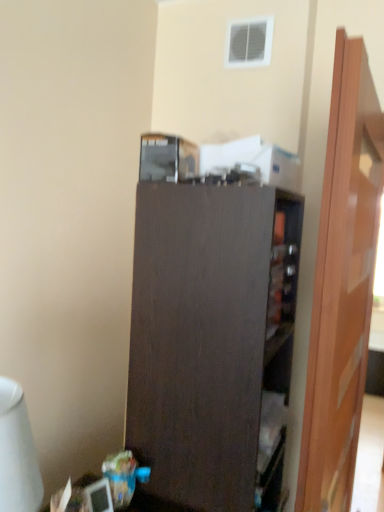
Question: Is point (33, 440) closer or farther from the camera than point (195, 253)?

Choices:
 (A) closer
 (B) farther

Answer: (A)

Question: Visually, is white glossy table lamp at lower left positioned to the left or to the right of dark wood cupboard at center?

Choices:
 (A) left
 (B) right

Answer: (A)

Question: Estimate the real-world distances between objects in this image. Which object is farther from the dark wood cupboard at center?

Choices:
 (A) white glossy table lamp at lower left
 (B) wooden door at right

Answer: (A)

Question: Estimate the real-world distances between objects in this image. Which object is closer to the wooden door at right?

Choices:
 (A) white glossy table lamp at lower left
 (B) dark wood cupboard at center

Answer: (B)